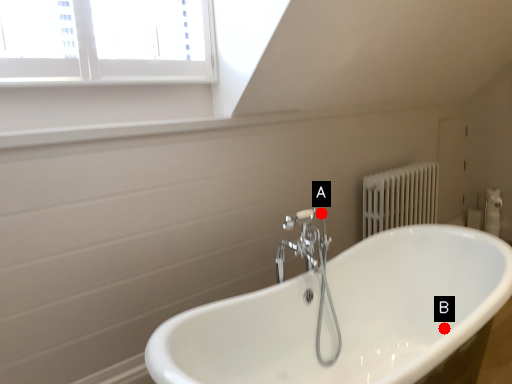
Question: Two points are circled on the image, labeled by A and B beside each circle. Which point is closer to the camera?

Choices:
 (A) A is closer
 (B) B is closer

Answer: (A)